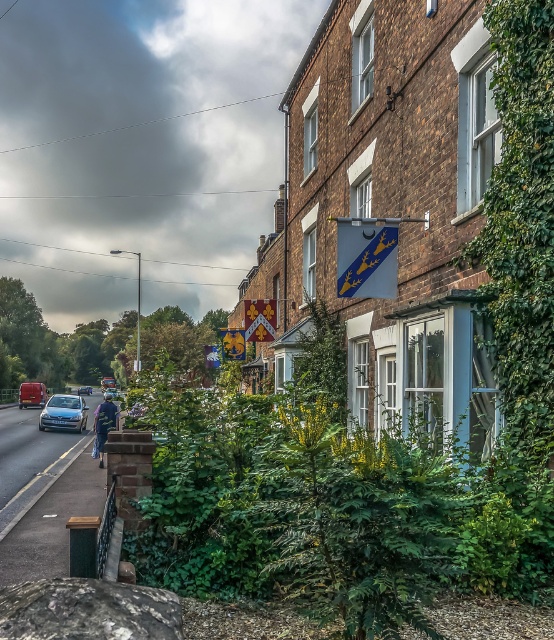
The width and height of the screenshot is (554, 640). I want to click on satin silver sedan at lower left, so click(x=64, y=412).

Is metallic silver van at left wider than silver metallic car at center?

Incorrect, metallic silver van at left's width does not surpass silver metallic car at center's.

Does point (24, 384) come in front of point (83, 387)?

Yes, it is.

This screenshot has height=640, width=554. In order to click on metallic silver van at left in this screenshot , I will do `click(32, 394)`.

Based on the photo, which is more to the left, satin silver sedan at lower left or metallic silver van at left?

Positioned to the left is metallic silver van at left.

Which of these two, satin silver sedan at lower left or metallic silver van at left, stands shorter?

With less height is satin silver sedan at lower left.

Which is in front, point (84, 428) or point (38, 384)?

Positioned in front is point (84, 428).

Image resolution: width=554 pixels, height=640 pixels. I want to click on satin silver sedan at lower left, so click(x=64, y=412).